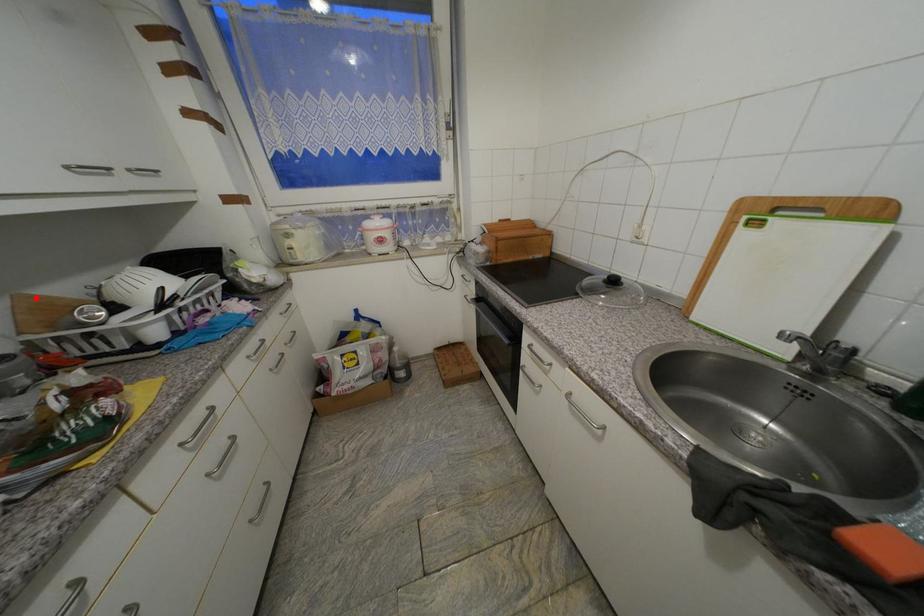
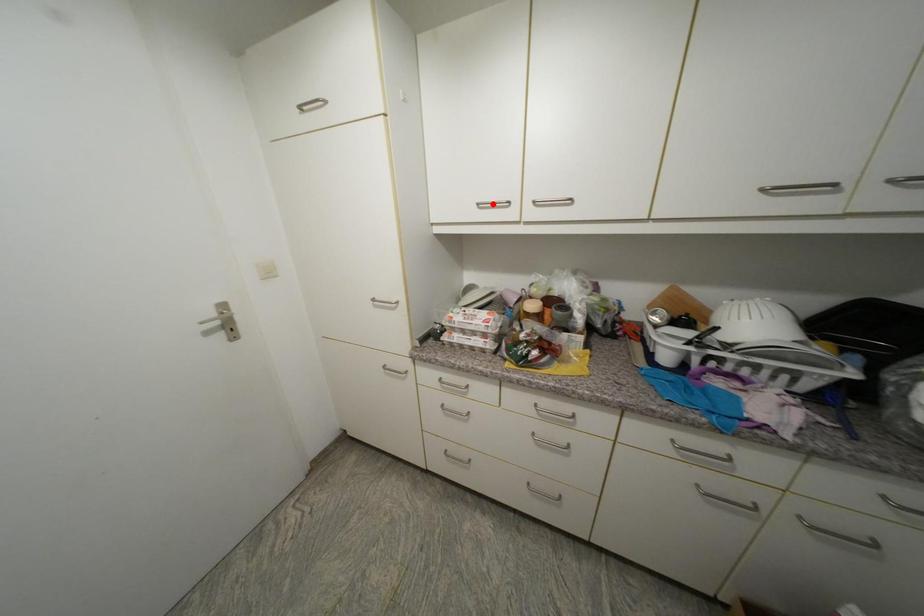
I am providing you with two images of the same scene from different viewpoints. A red point is marked on the first image and another point is marked on the second image. Do the highlighted points in image1 and image2 indicate the same real-world spot?

No